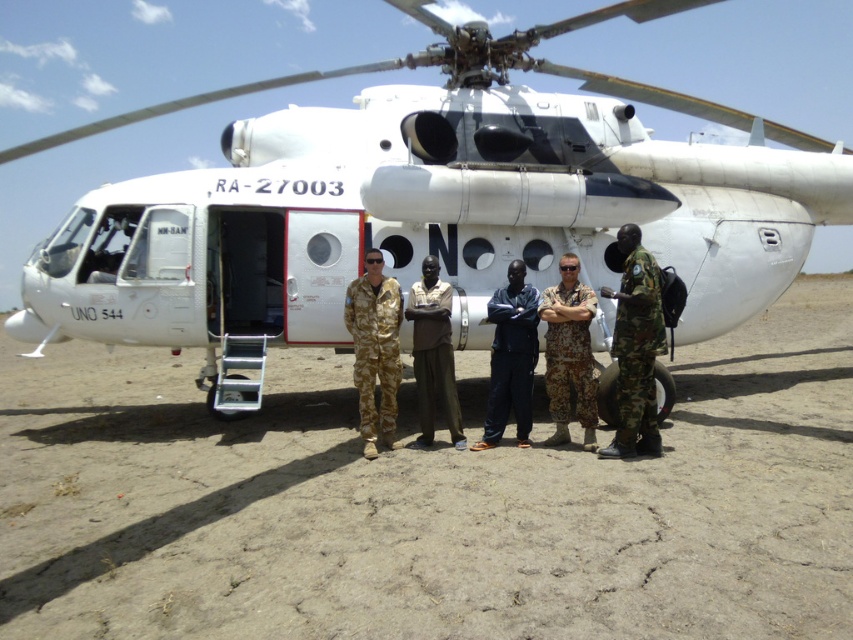
You are a photographer trying to capture a clear shot of the white matte helicopter at center without any obstructions. However, there is an individual wearing brown fabric pants at center in your line of sight. Based on the scene description, can you adjust your position to avoid the person while still keeping the helicopter in view?

The white matte helicopter at center is positioned over brown fabric pants at center, meaning the helicopter is directly above the person. To capture the helicopter without the person, you could position yourself lower or angle your camera upwards to frame the helicopter while excluding the person below.

You are a photographer trying to capture a group photo of the camouflage uniform at center and the brown fabric pants at center. Since you want to ensure both subjects are in focus, you need to know their heights. Which one is taller?

The camouflage uniform at center is taller than brown fabric pants at center.

You are a photographer who needs to capture a clear photo of the registration number on the helicopter. You are currently standing at the position of the camouflage fabric uniform at center. The camera you are using has a maximum zoom range that can focus on objects up to 5 meters away. Can you take a clear photo of the registration number without moving closer?

The camouflage fabric uniform at center and camera are 5.74 meters apart from each other. Since the maximum zoom range is 5 meters, you cannot take a clear photo of the registration number without moving closer.